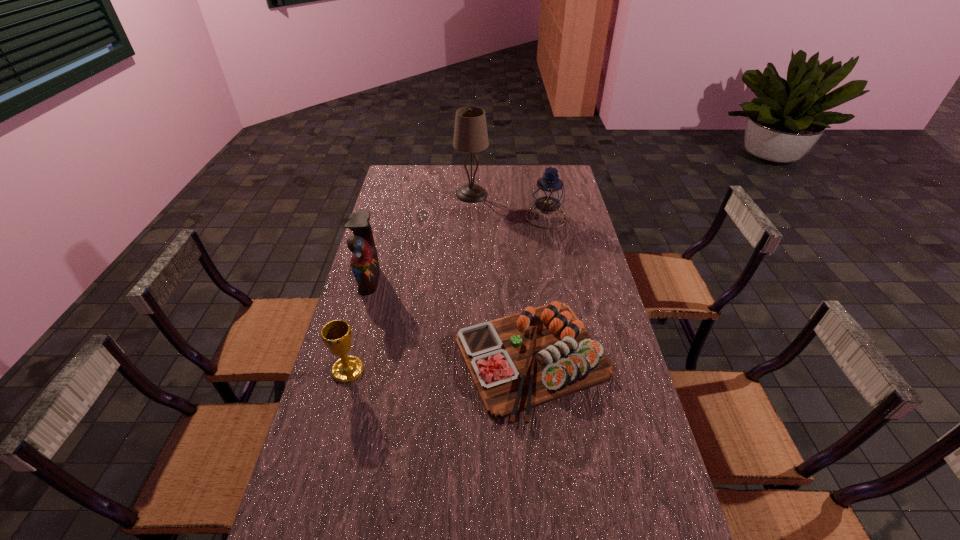
The image size is (960, 540). Find the location of `vacant space located on the front-facing side of the fourth nearest object`. vacant space located on the front-facing side of the fourth nearest object is located at coordinates (459, 217).

Find the location of a particular element. The image size is (960, 540). vacant space positioned 0.240m on the back of the chalice is located at coordinates (367, 302).

The height and width of the screenshot is (540, 960). Find the location of `vacant region located on the back of the platter`. vacant region located on the back of the platter is located at coordinates (520, 248).

The height and width of the screenshot is (540, 960). In order to click on object positioned at the far edge in this screenshot , I will do `click(470, 133)`.

Locate an element on the screen. The width and height of the screenshot is (960, 540). parrot that is at the left edge is located at coordinates tap(364, 262).

The height and width of the screenshot is (540, 960). In order to click on chalice that is at the left edge in this screenshot , I will do `click(336, 335)`.

The height and width of the screenshot is (540, 960). I want to click on lantern that is at the right edge, so click(549, 193).

Identify the location of platter that is at the right edge. (521, 361).

I want to click on free region at the far edge of the desktop, so click(459, 184).

Find the location of a particular element. vacant space at the left edge of the desktop is located at coordinates (375, 226).